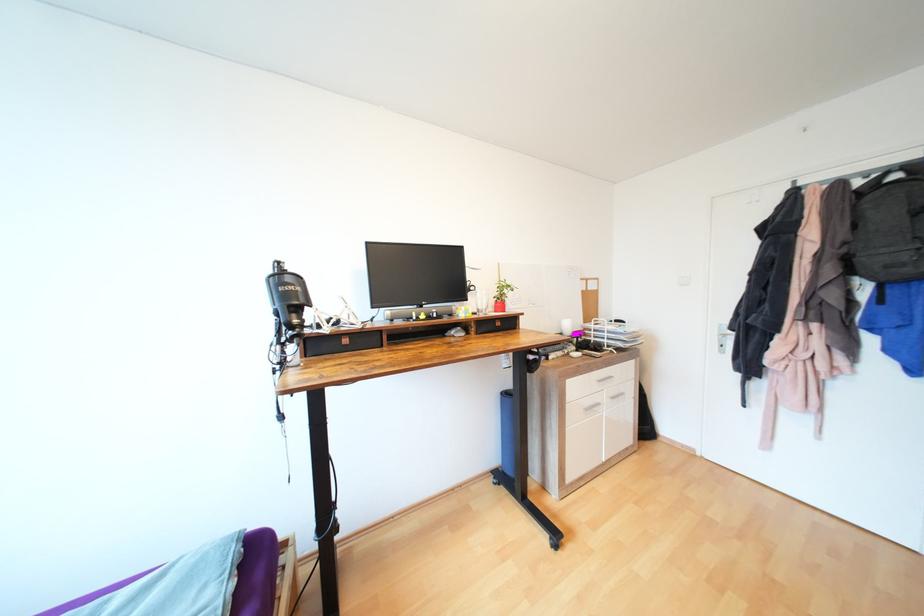
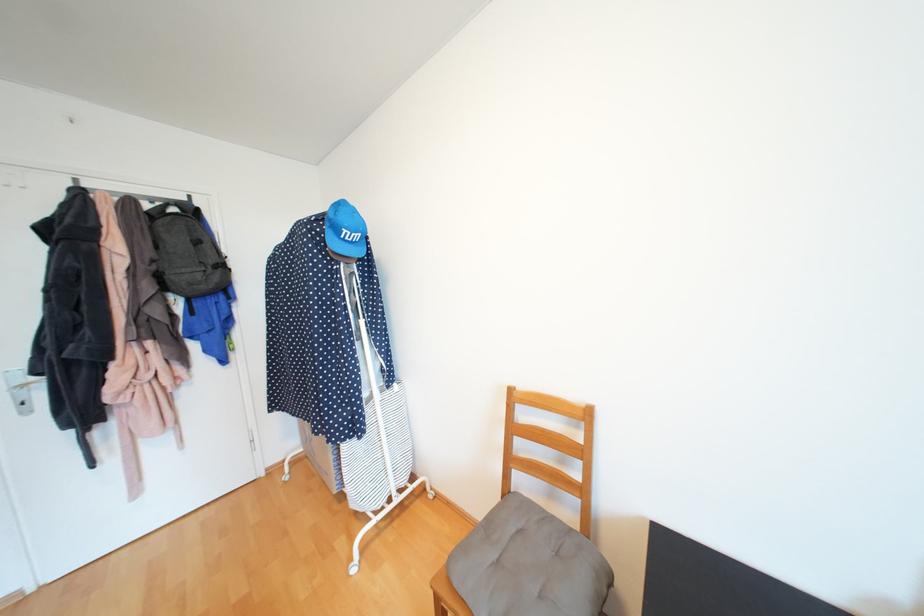
Where in the second image is the point corresponding to [731,336] from the first image?

(30, 387)